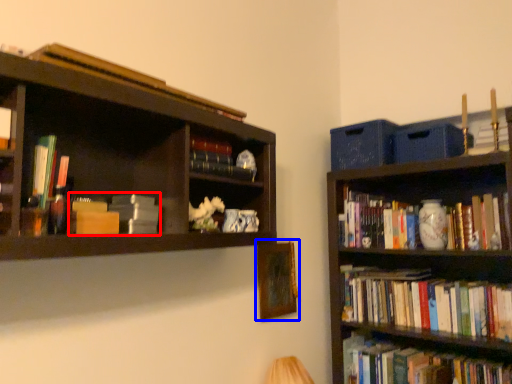
Question: Which object appears farthest to the camera in this image, book (highlighted by a red box) or picture frame (highlighted by a blue box)?

Choices:
 (A) book
 (B) picture frame

Answer: (B)